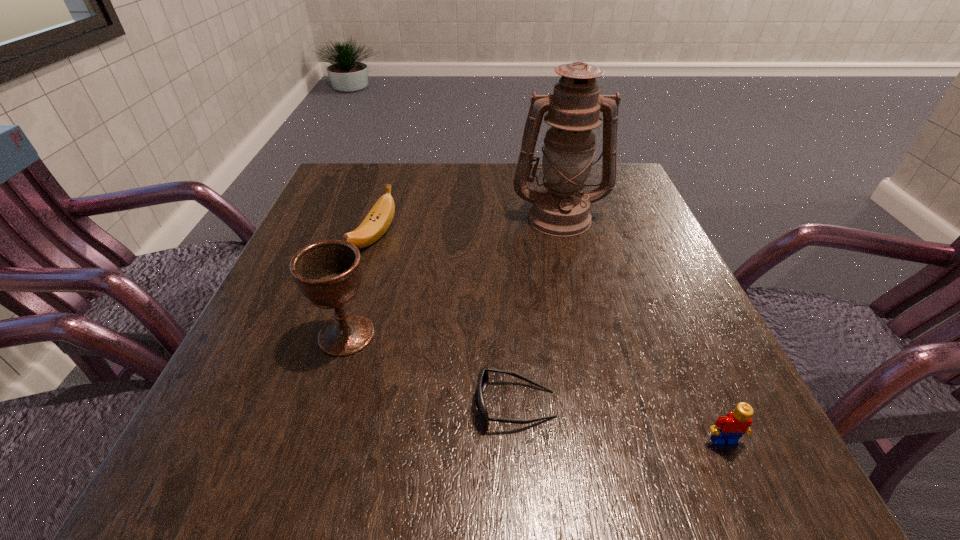
The width and height of the screenshot is (960, 540). I want to click on unoccupied area between the Lego and the second tallest object, so click(x=535, y=388).

Locate an element on the screen. The width and height of the screenshot is (960, 540). unoccupied position between the banana and the rightmost object is located at coordinates (548, 340).

Image resolution: width=960 pixels, height=540 pixels. In order to click on vacant area that lies between the tallest object and the Lego in this screenshot , I will do `click(641, 329)`.

At what (x,y) coordinates should I click in order to perform the action: click on free space between the banana and the fourth shortest object. Please return your answer as a coordinate pair (x, y). Looking at the image, I should click on (360, 287).

Where is `free space between the chalice and the banana`? The width and height of the screenshot is (960, 540). free space between the chalice and the banana is located at coordinates (360, 287).

Find the location of a particular element. This screenshot has width=960, height=540. free space that is in between the third nearest object and the banana is located at coordinates (360, 287).

Where is `unoccupied position between the third nearest object and the tallest object`? This screenshot has width=960, height=540. unoccupied position between the third nearest object and the tallest object is located at coordinates (453, 276).

This screenshot has width=960, height=540. Find the location of `vacant space in between the third farthest object and the banana`. vacant space in between the third farthest object and the banana is located at coordinates (360, 287).

The width and height of the screenshot is (960, 540). What are the coordinates of `vacant area between the third farthest object and the banana` in the screenshot? It's located at (360, 287).

At what (x,y) coordinates should I click in order to perform the action: click on free space between the oil lamp and the rightmost object. Please return your answer as a coordinate pair (x, y). Image resolution: width=960 pixels, height=540 pixels. Looking at the image, I should click on (641, 329).